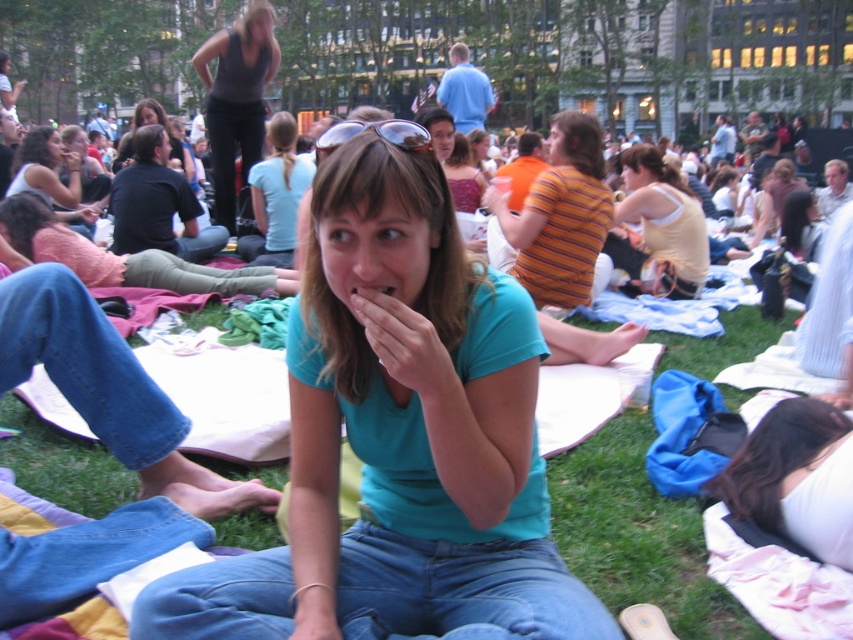
Question: Does dark gray tank top at upper center have a smaller size compared to matte teal shirt at center?

Choices:
 (A) yes
 (B) no

Answer: (B)

Question: Which point is farther to the camera?

Choices:
 (A) (51, 136)
 (B) (288, 189)
 (C) (680, 256)
 (D) (173, 141)

Answer: (D)

Question: Which of these objects is positioned closest to the matte black shirt at upper left?

Choices:
 (A) teal matte shirt at center
 (B) matte teal shirt at center
 (C) light blue t-shirt at center
 (D) dark gray tank top at upper center

Answer: (B)

Question: Which object is the closest to the teal matte shirt at center?

Choices:
 (A) matte teal shirt at center
 (B) matte yellow tank top at center
 (C) dark gray tank top at upper center
 (D) matte black shirt at upper left

Answer: (B)

Question: Can you confirm if matte yellow tank top at center is positioned above light blue t-shirt at center?

Choices:
 (A) yes
 (B) no

Answer: (B)

Question: Does teal matte shirt at center come in front of matte yellow tank top at center?

Choices:
 (A) yes
 (B) no

Answer: (A)